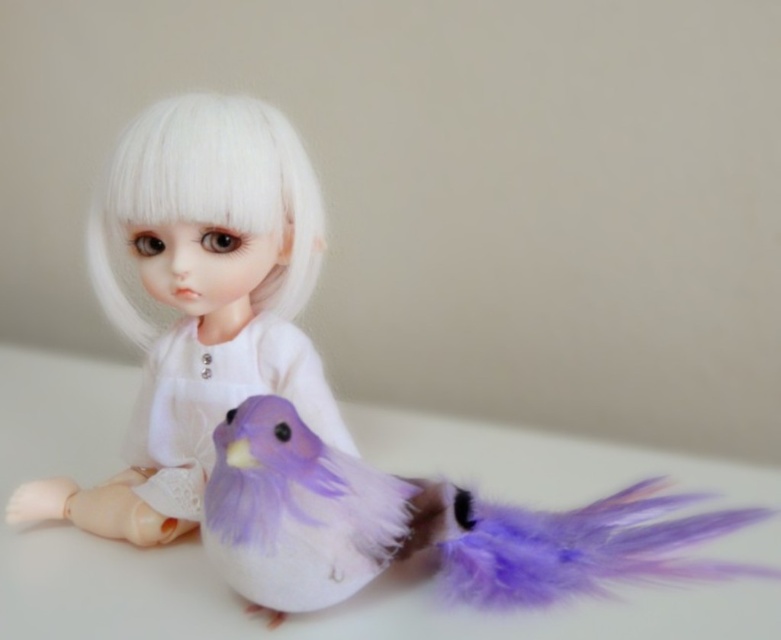
You are a toy organizer trying to arrange the purple feathered bird at center and the white silky hair at center on a shelf. Which toy should you place first if you want to arrange them from tallest to shortest?

The white silky hair at center is taller than the purple feathered bird at center, so you should place the white silky hair at center first as the tallest item followed by the purple feathered bird at center.

You are a toy organizer arranging items on a shelf. You have the white matte doll at center and the white silky hair at center. According to the image, which object is located above the other?

The white silky hair at center is above the white matte doll at center because the description states that the white matte doll at center is positioned under the white silky hair at center.